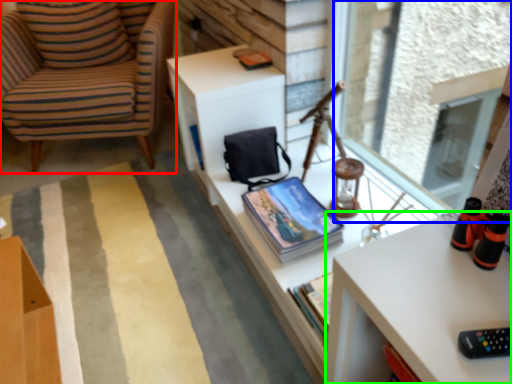
Question: Based on their relative distances, which object is farther from chair (highlighted by a red box)? Choose from window screen (highlighted by a blue box) and desk (highlighted by a green box).

Choices:
 (A) window screen
 (B) desk

Answer: (B)